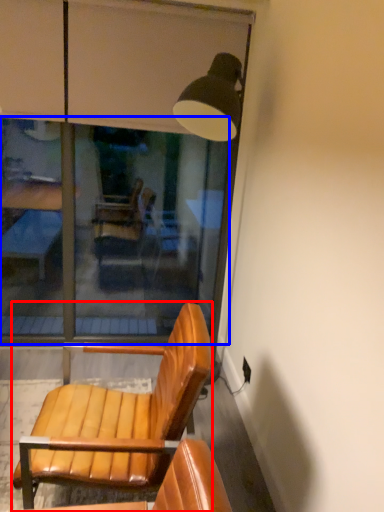
Question: Among these objects, which one is farthest to the camera, chair (highlighted by a red box) or glass window (highlighted by a blue box)?

Choices:
 (A) chair
 (B) glass window

Answer: (B)